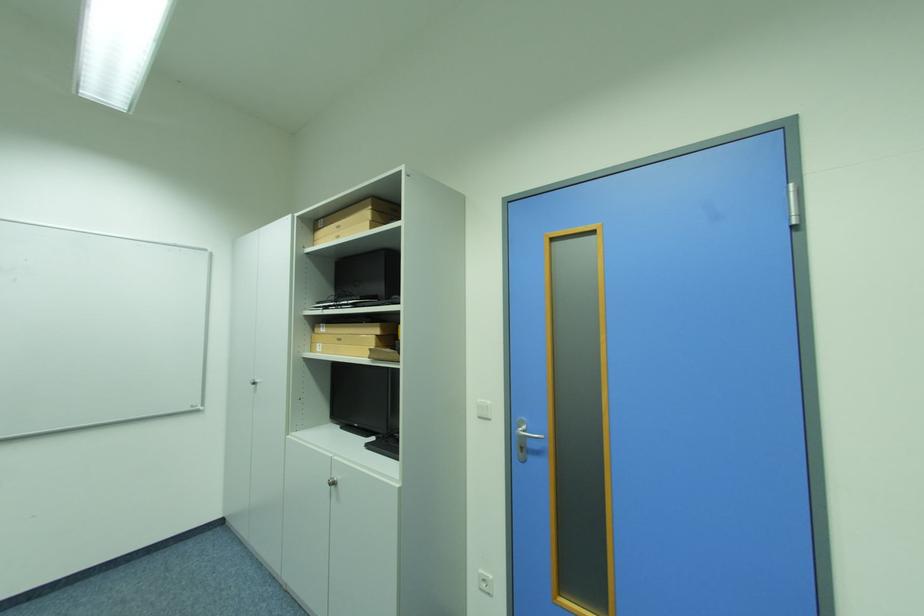
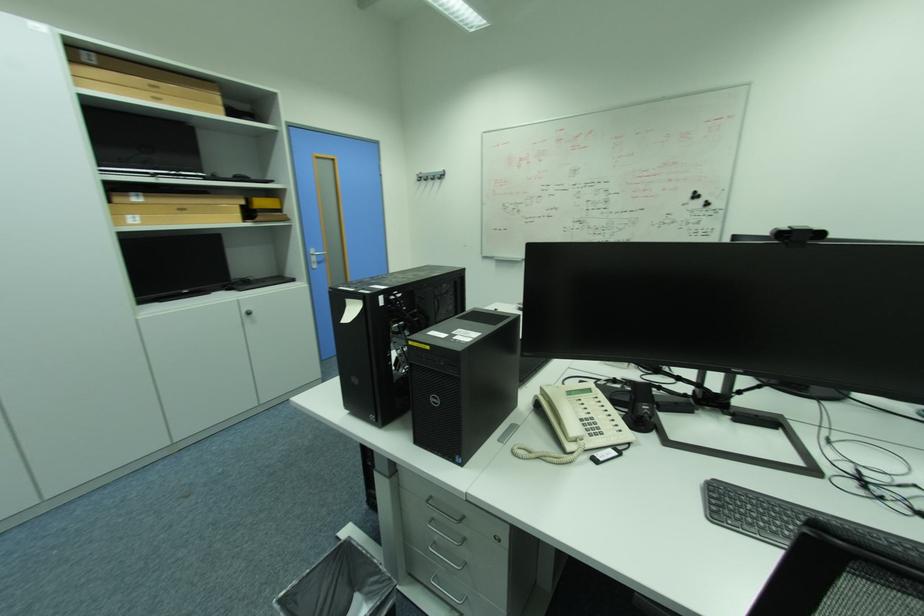
Find the pixel in the second image that matches point 325,345 in the first image.

(136, 217)